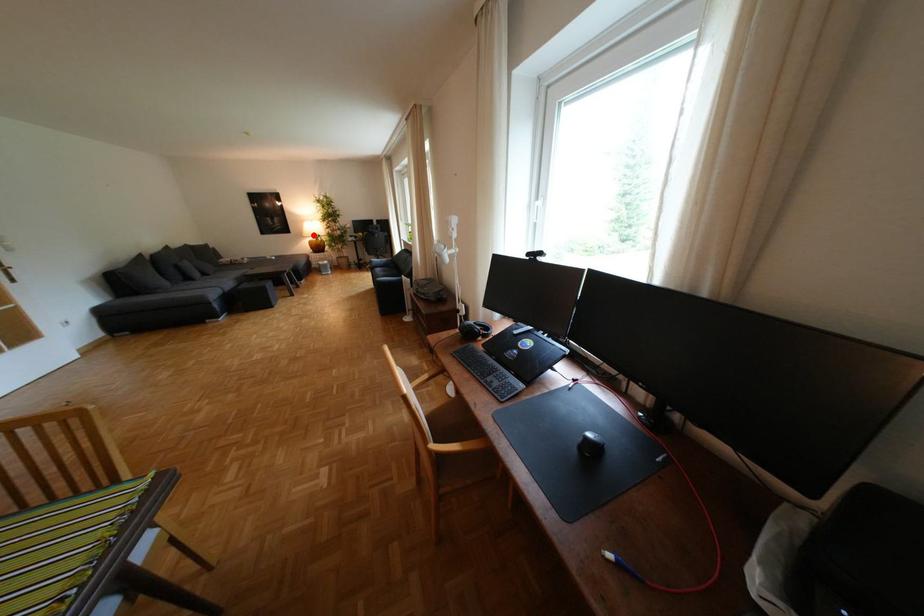
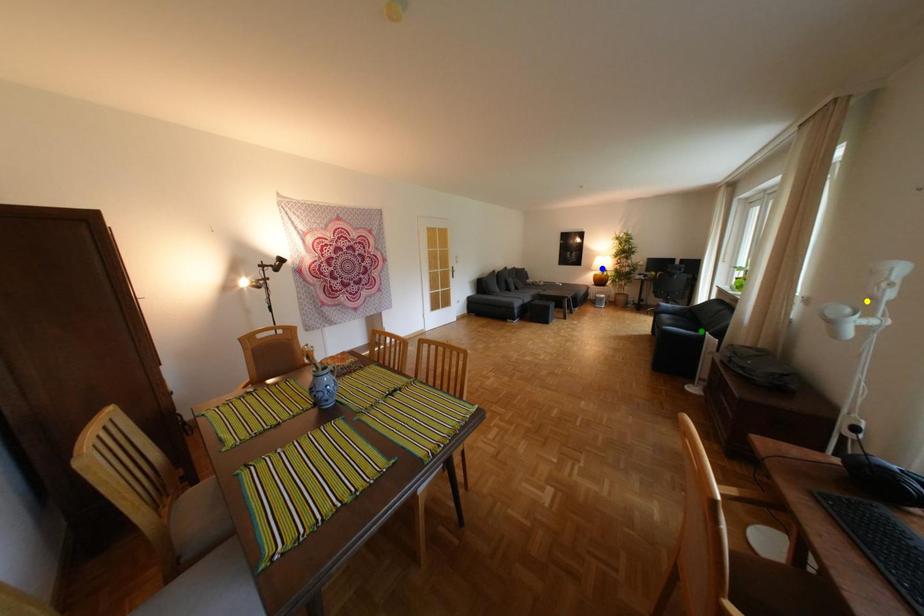
Question: I am providing you with two images of the same scene from different viewpoints. A red point is marked on the first image. You are given multiple points on the second image. Which point in image 2 represents the same 3d spot as the red point in image 1?

Choices:
 (A) blue point
 (B) green point
 (C) yellow point

Answer: (A)